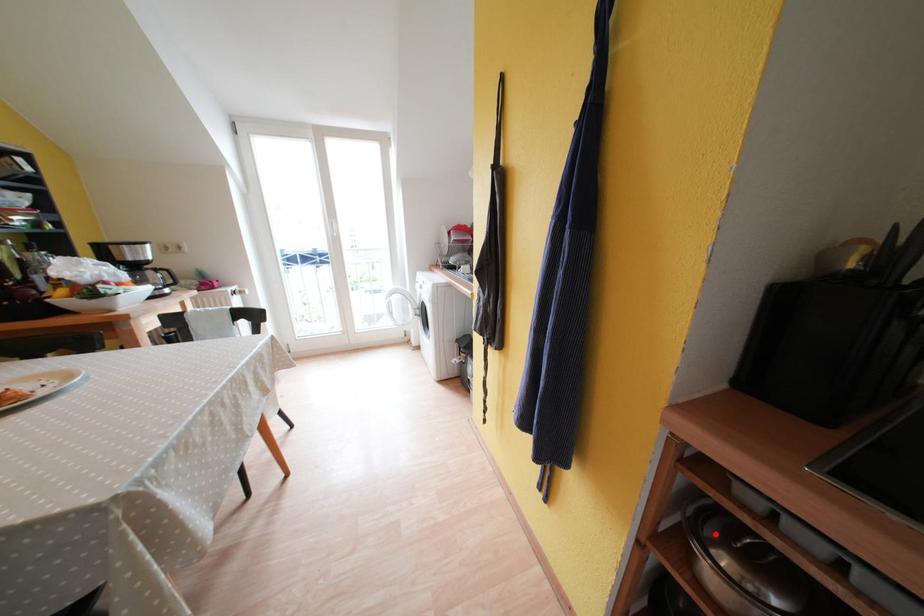
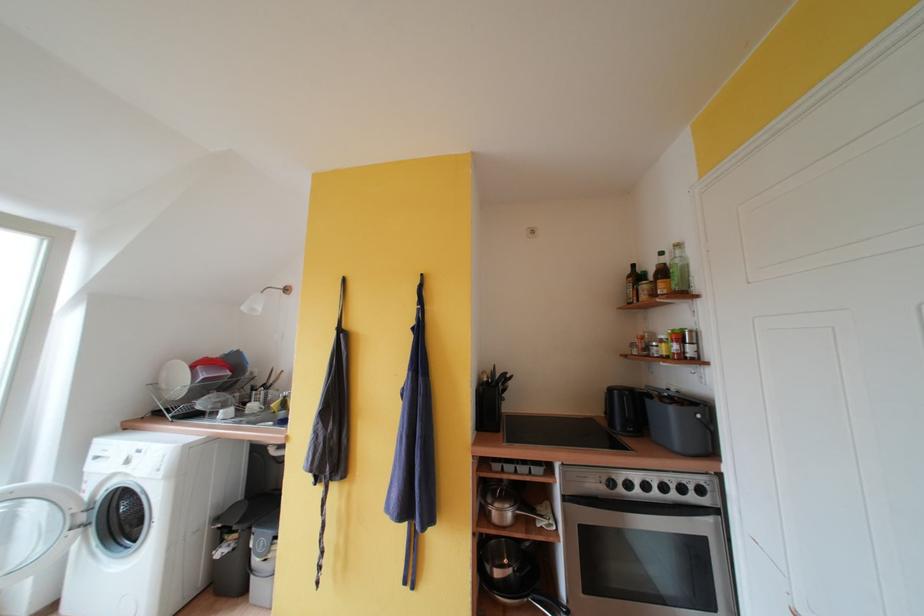
Question: I am providing you with two images of the same scene from different viewpoints. Given a red point in image1, look at the same physical point in image2. Is it:

Choices:
 (A) Closer to the viewpoint
 (B) Farther from the viewpoint

Answer: (B)